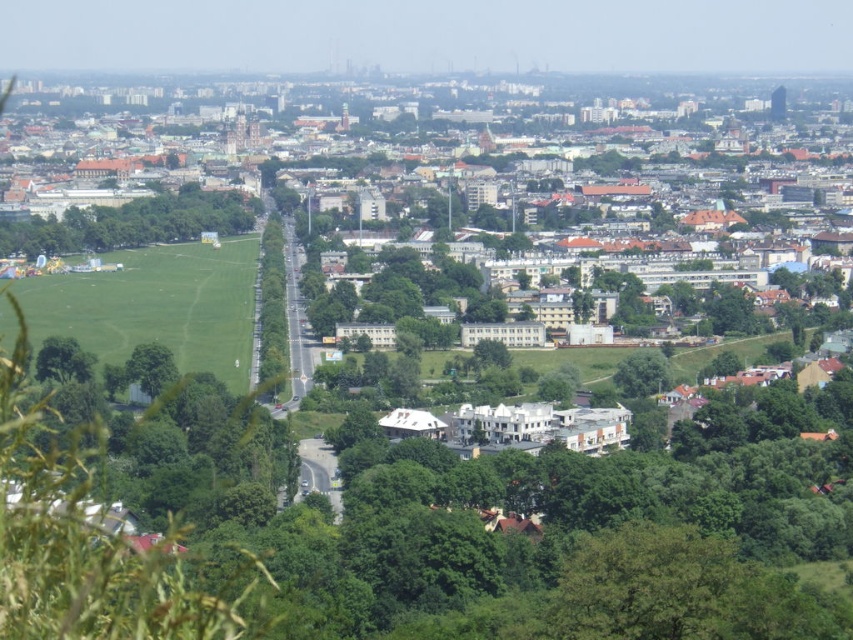
From the picture: You are standing at the edge of the green leafy tree at center and want to walk towards the green grass field at lower left. Which direction should you head?

The green grass field at lower left is to the right of green leafy tree at center, so you should head to the right.

You are standing at the center of the image and want to locate the green leafy tree at center. What are the coordinates where you should look?

The green leafy tree at center is located at coordinates point [271,310].

From the picture: You are planning to set up a picnic area in the city park shown in the image. You have a large picnic blanket that is 3 meters wide. Which object, the green grass field at lower left or the green leafy tree at lower right, would be more suitable to place the blanket without it overlapping with other objects?

The green grass field at lower left has a larger width than the green leafy tree at lower right, so placing the 3 meter wide picnic blanket on the green grass field at lower left would be more suitable as it has enough space.